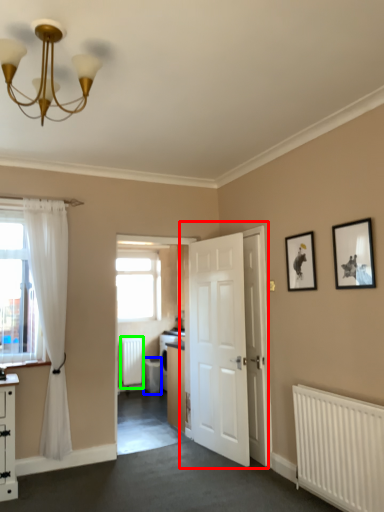
Question: Estimate the real-world distances between objects in this image. Which object is closer to door (highlighted by a red box), dish washer (highlighted by a blue box) or radiator (highlighted by a green box)?

Choices:
 (A) dish washer
 (B) radiator

Answer: (A)